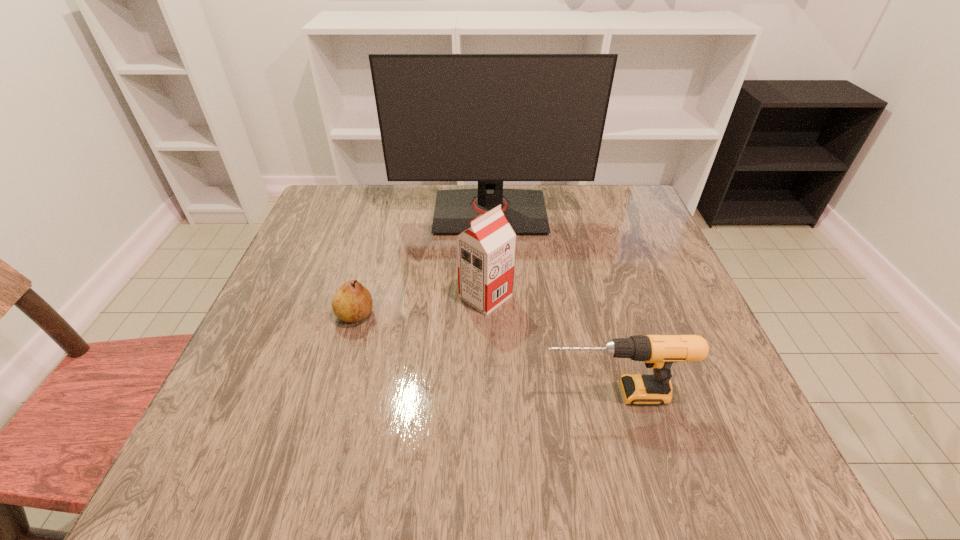
Find the location of a particular element. This screenshot has height=540, width=960. vacant region located on the handle side of the third tallest object is located at coordinates (474, 394).

Identify the location of vacant area situated 0.400m on the right of the shortest object. (565, 315).

Find the location of a particular element. The width and height of the screenshot is (960, 540). object that is positioned at the far edge is located at coordinates (490, 118).

I want to click on object positioned at the left edge, so click(352, 302).

Find the location of `object at the right edge`. object at the right edge is located at coordinates tap(658, 352).

Identify the location of vacant point at the far edge. (404, 188).

In the image, there is a desktop. Identify the location of vacant space at the near edge. This screenshot has width=960, height=540. (573, 474).

Locate an element on the screen. The image size is (960, 540). vacant area at the left edge is located at coordinates (301, 249).

Image resolution: width=960 pixels, height=540 pixels. Find the location of `free space at the right edge`. free space at the right edge is located at coordinates (714, 411).

What are the coordinates of `vacant area at the far left corner` in the screenshot? It's located at (338, 215).